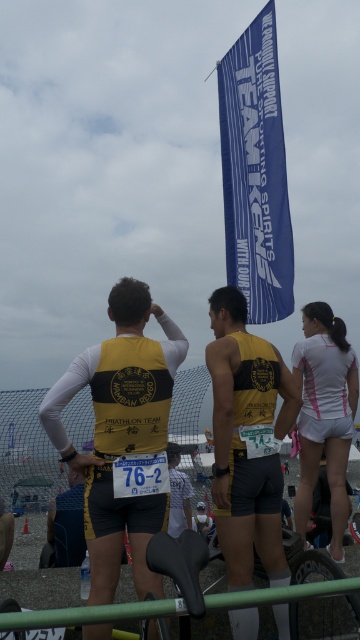
Question: Does yellow matte vest at center have a lesser width compared to yellow fabric vest at center?

Choices:
 (A) no
 (B) yes

Answer: (A)

Question: Is blue fabric banner at upper center thinner than white matte shirt at center?

Choices:
 (A) no
 (B) yes

Answer: (A)

Question: Which of the following is the closest to the observer?

Choices:
 (A) yellow matte triathlon suit at center
 (B) white matte shirt at center
 (C) yellow matte vest at center
 (D) white matte shorts at right

Answer: (C)

Question: Based on their relative distances, which object is farther from the yellow matte triathlon suit at center?

Choices:
 (A) yellow matte vest at center
 (B) green rubber rail at lower center

Answer: (B)

Question: Is blue fabric banner at upper center above green rubber rail at lower center?

Choices:
 (A) yes
 (B) no

Answer: (A)

Question: Which point is closer to the camera?

Choices:
 (A) (338, 483)
 (B) (227, 513)

Answer: (B)